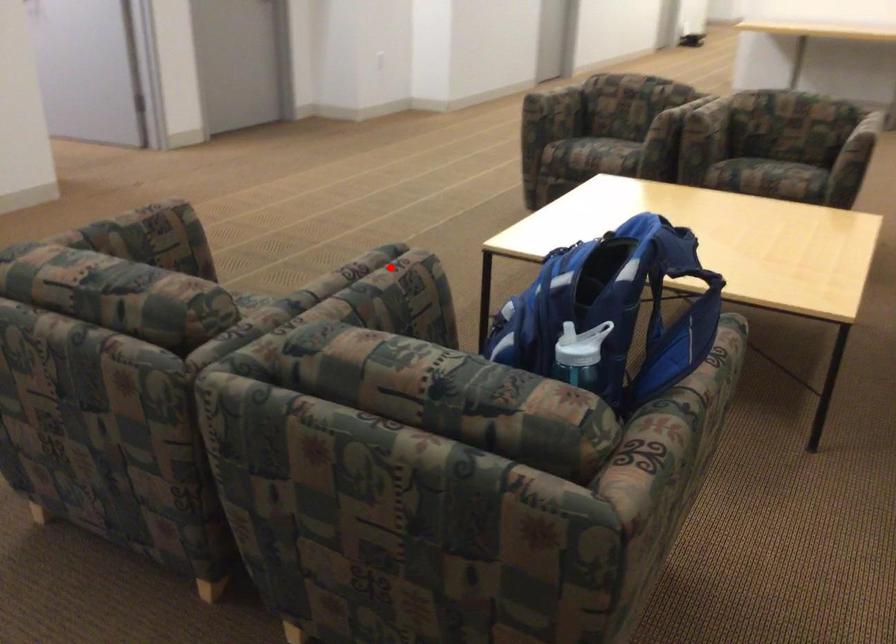
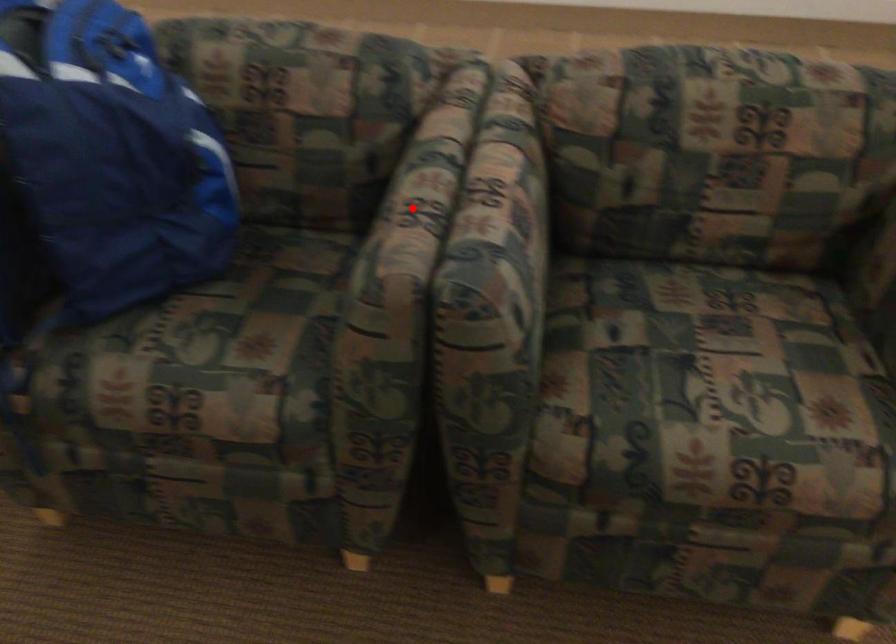
Based on the photo, I am providing you with two images of the same scene from different viewpoints. A red point is marked on the first image and another point is marked on the second image. Are the points marked in image1 and image2 representing the same 3D position?

Yes